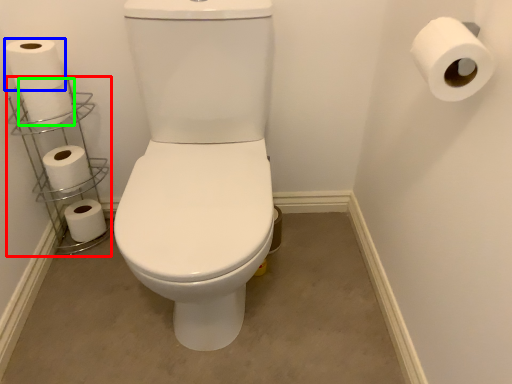
Question: Based on their relative distances, which object is farther from shelf (highlighted by a red box)? Choose from toilet paper (highlighted by a blue box) and toilet paper (highlighted by a green box).

Choices:
 (A) toilet paper
 (B) toilet paper

Answer: (A)